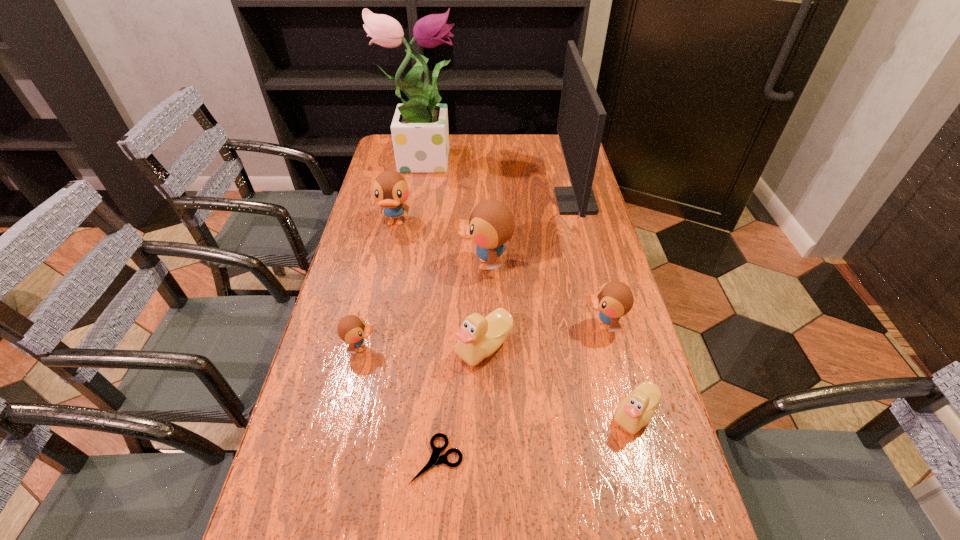
Locate an element on the screen. The width and height of the screenshot is (960, 540). the smallest blue duck is located at coordinates [x=352, y=329].

I want to click on the nearer beige duck, so click(635, 411).

Identify the location of the nearest duck. This screenshot has height=540, width=960. (635, 411).

This screenshot has width=960, height=540. Find the location of `the shortest object`. the shortest object is located at coordinates (435, 459).

Find the location of a particular element. This screenshot has width=960, height=540. vacant space situated on the front-facing side of the green flower arrangement is located at coordinates (495, 158).

Locate an element on the screen. The width and height of the screenshot is (960, 540). blank space located 0.350m on the front-facing side of the eighth shortest object is located at coordinates (455, 202).

This screenshot has height=540, width=960. In order to click on blank area located on the front-facing side of the eighth shortest object in this screenshot , I will do `click(524, 202)`.

What are the coordinates of `vacant space located on the front-facing side of the eighth shortest object` in the screenshot? It's located at (490, 202).

You are a GUI agent. You are given a task and a screenshot of the screen. Output one action in this format:
    pyautogui.click(x=<x>, y=<y>)
    Task: Click on the vacant point located 0.110m on the front-facing side of the tallest duck
    
    Given the screenshot: What is the action you would take?
    pyautogui.click(x=419, y=264)

Where is `vacant space positioned on the front-facing side of the tallest duck`? vacant space positioned on the front-facing side of the tallest duck is located at coordinates point(358,264).